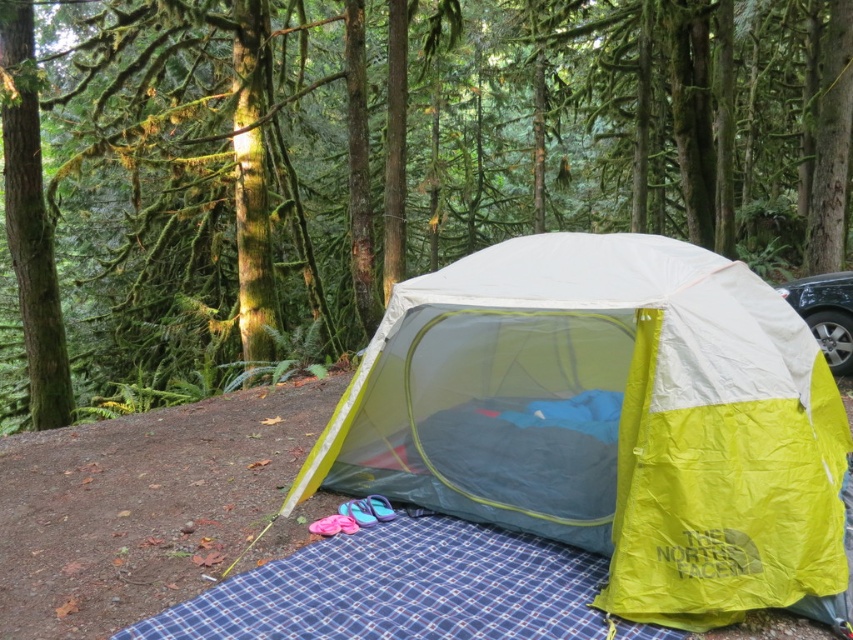
You are a hiker who wants to take a photo of both the green mossy tree at center and the green mossy bark tree at upper left. Since you only have one shot, you need to position yourself so that both trees are in the frame. Based on their positions, which tree should you focus on to ensure both are in focus?

You should focus on the green mossy bark tree at upper left because it is farther away from the viewer than the green mossy tree at center, so focusing on the farther tree will help keep both in focus.